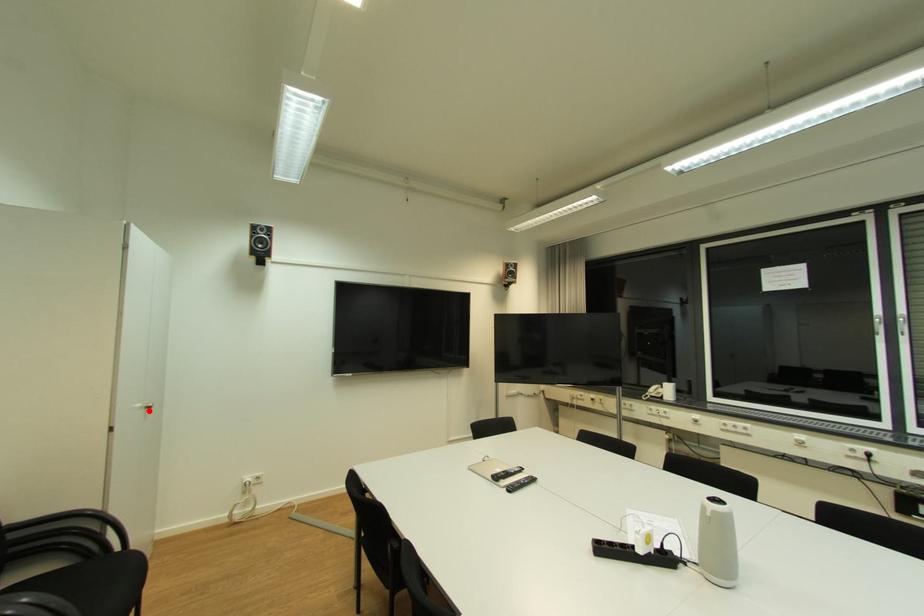
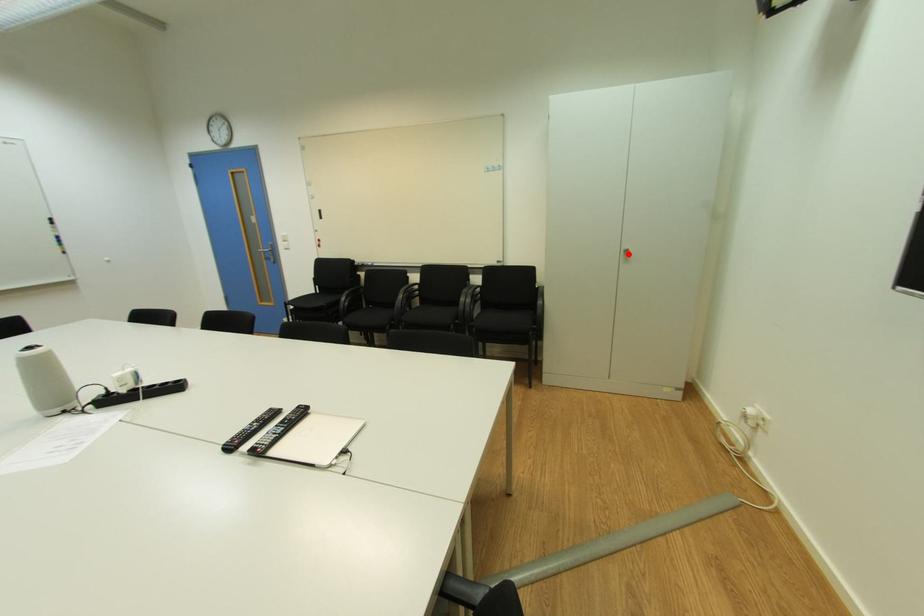
I am providing you with two images of the same scene from different viewpoints. A red point is marked on the first image and another point is marked on the second image. Do the highlighted points in image1 and image2 indicate the same real-world spot?

Yes